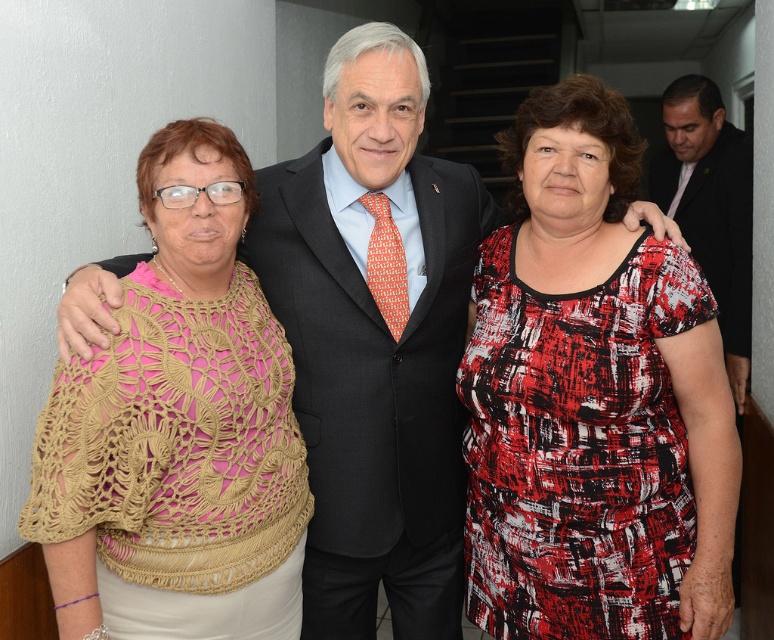
Does crochet beige shawl at left have a lesser width compared to black wool suit at center?

Indeed, crochet beige shawl at left has a lesser width compared to black wool suit at center.

Who is positioned more to the right, crochet beige shawl at left or black wool suit at center?

From the viewer's perspective, black wool suit at center appears more on the right side.

Locate an element on the screen. The height and width of the screenshot is (640, 774). crochet beige shawl at left is located at coordinates (177, 428).

Between dark suit at right and black wool suit at center, which one has less height?

Standing shorter between the two is black wool suit at center.

Can you confirm if dark suit at right is taller than black wool suit at center?

Yes, dark suit at right is taller than black wool suit at center.

The image size is (774, 640). I want to click on dark suit at right, so click(711, 209).

Is point (543, 515) positioned behind point (737, 320)?

No, it is in front of (737, 320).

Looking at this image, does red and black printed dress at right have a larger size compared to dark suit at right?

No.

This screenshot has height=640, width=774. What are the coordinates of `red and black printed dress at right` in the screenshot? It's located at (577, 449).

Locate an element on the screen. The image size is (774, 640). red and black printed dress at right is located at coordinates (577, 449).